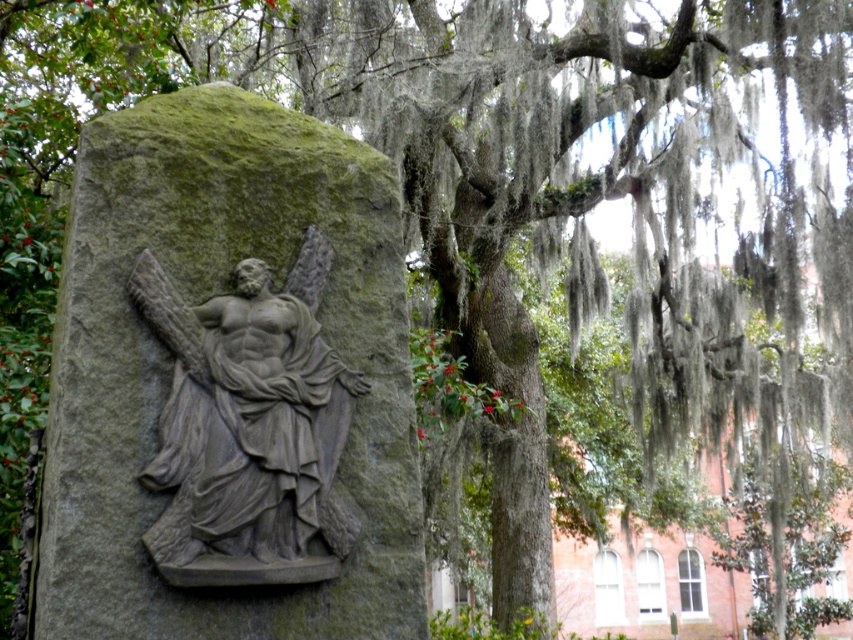
Question: Which object appears farthest from the camera in this image?

Choices:
 (A) gray stone sculpture at center
 (B) gray stone carving at center

Answer: (A)

Question: Observing the image, what is the correct spatial positioning of gray stone carving at center in reference to gray stone sculpture at center?

Choices:
 (A) above
 (B) below

Answer: (A)

Question: Which of the following is the closest to the observer?

Choices:
 (A) coord(329,541)
 (B) coord(178,481)

Answer: (B)

Question: Is gray stone carving at center positioned at the back of gray stone sculpture at center?

Choices:
 (A) yes
 (B) no

Answer: (B)

Question: From the image, what is the correct spatial relationship of gray stone carving at center in relation to gray stone sculpture at center?

Choices:
 (A) below
 (B) above

Answer: (B)